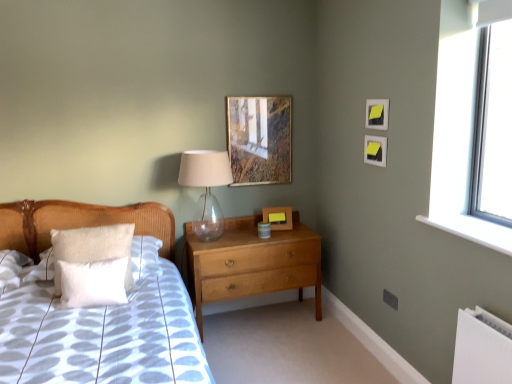
Find the location of a particular element. vacant area situated below light brown wood chest of drawers at center (from a real-world perspective) is located at coordinates (264, 315).